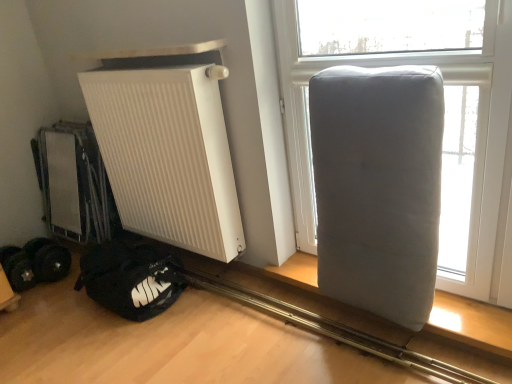
The width and height of the screenshot is (512, 384). What do you see at coordinates (130, 279) in the screenshot? I see `black fabric sleeping bag at lower left` at bounding box center [130, 279].

What do you see at coordinates (168, 155) in the screenshot?
I see `white matte radiator at left` at bounding box center [168, 155].

Describe the element at coordinates (35, 263) in the screenshot. Image resolution: width=512 pixels, height=384 pixels. I see `black rubber weights at lower left` at that location.

Locate an element on the screen. This screenshot has height=384, width=512. black fabric sleeping bag at lower left is located at coordinates (130, 279).

Which object is wider, white matte radiator at left or gray fabric cushion at right?

With larger width is white matte radiator at left.

Is white matte radiator at left smaller than gray fabric cushion at right?

No, white matte radiator at left is not smaller than gray fabric cushion at right.

Is white matte radiator at left positioned before gray fabric cushion at right?

No, the depth of white matte radiator at left is greater than that of gray fabric cushion at right.

Is white matte radiator at left positioned with its back to gray fabric cushion at right?

No, gray fabric cushion at right is not at the back of white matte radiator at left.

Is gray fabric mattress at right turned away from black rubber weights at lower left?

No.

Is the depth of gray fabric mattress at right less than that of black rubber weights at lower left?

Yes, gray fabric mattress at right is closer to the camera.

Is gray fabric mattress at right next to black rubber weights at lower left and touching it?

No.

Considering the sizes of objects gray fabric mattress at right and black rubber weights at lower left in the image provided, who is shorter, gray fabric mattress at right or black rubber weights at lower left?

With less height is black rubber weights at lower left.

From the image's perspective, does gray fabric mattress at right appear higher than gray fabric cushion at right?

No, from the image's perspective, gray fabric mattress at right is not on top of gray fabric cushion at right.

Is gray fabric cushion at right at the back of gray fabric mattress at right?

Yes, gray fabric mattress at right is facing away from gray fabric cushion at right.

Does gray fabric mattress at right have a larger size compared to gray fabric cushion at right?

Correct, gray fabric mattress at right is larger in size than gray fabric cushion at right.

Consider the image. Is gray fabric mattress at right situated inside gray fabric cushion at right or outside?

The correct answer is: outside.

Measure the distance from white matte radiator at left to black rubber weights at lower left.

white matte radiator at left and black rubber weights at lower left are 31.73 inches apart from each other.

From a real-world perspective, who is located lower, white matte radiator at left or black rubber weights at lower left?

black rubber weights at lower left, from a real-world perspective.

Considering the relative sizes of white matte radiator at left and black rubber weights at lower left in the image provided, is white matte radiator at left shorter than black rubber weights at lower left?

In fact, white matte radiator at left may be taller than black rubber weights at lower left.

Is white matte radiator at left wider or thinner than black rubber weights at lower left?

In the image, white matte radiator at left appears to be more narrow than black rubber weights at lower left.

From the image's perspective, is black fabric sleeping bag at lower left located above or below gray fabric mattress at right?

From the image's perspective, black fabric sleeping bag at lower left appears below gray fabric mattress at right.

Is black fabric sleeping bag at lower left turned away from gray fabric mattress at right?

black fabric sleeping bag at lower left does not have its back to gray fabric mattress at right.

In terms of width, does black fabric sleeping bag at lower left look wider or thinner when compared to gray fabric mattress at right?

Clearly, black fabric sleeping bag at lower left has more width compared to gray fabric mattress at right.

At what (x,y) coordinates should I click in order to perform the action: click on sleeping bag behind the gray fabric mattress at right. Please return your answer as a coordinate pair (x, y). The height and width of the screenshot is (384, 512). Looking at the image, I should click on (130, 279).

Considering the sizes of objects black fabric sleeping bag at lower left and gray fabric cushion at right in the image provided, who is smaller, black fabric sleeping bag at lower left or gray fabric cushion at right?

black fabric sleeping bag at lower left is smaller.

Which is more to the left, black fabric sleeping bag at lower left or gray fabric cushion at right?

black fabric sleeping bag at lower left is more to the left.

Does black fabric sleeping bag at lower left have a greater width compared to gray fabric cushion at right?

Yes.

Is point (134, 263) closer to camera compared to point (504, 291)?

No, it is behind (504, 291).

Does black rubber weights at lower left have a lesser height compared to gray fabric cushion at right?

Yes.

Would you say black rubber weights at lower left is inside or outside gray fabric cushion at right?

black rubber weights at lower left exists outside the volume of gray fabric cushion at right.

Who is more distant, black rubber weights at lower left or gray fabric cushion at right?

black rubber weights at lower left is behind.

Is point (14, 274) positioned in front of point (305, 171)?

No, (14, 274) is further to viewer.

Identify the location of window in front of the white matte radiator at left. The width and height of the screenshot is (512, 384). (472, 137).

At what (x,y) coordinates should I click in order to perform the action: click on furniture above the black rubber weights at lower left (from a real-world perspective). Please return your answer as a coordinate pair (x, y). The height and width of the screenshot is (384, 512). Looking at the image, I should click on (378, 186).

Estimate the real-world distances between objects in this image. Which object is further from gray fabric cushion at right, gray fabric mattress at right or black fabric sleeping bag at lower left?

The object further to gray fabric cushion at right is black fabric sleeping bag at lower left.

Looking at the image, which one is located further to white matte radiator at left, gray fabric cushion at right or black rubber weights at lower left?

black rubber weights at lower left is further to white matte radiator at left.

Estimate the real-world distances between objects in this image. Which object is closer to white matte radiator at left, gray fabric cushion at right or black fabric sleeping bag at lower left?

The object closer to white matte radiator at left is black fabric sleeping bag at lower left.

Considering their positions, is white matte radiator at left positioned further to gray fabric mattress at right than black rubber weights at lower left?

black rubber weights at lower left.

Based on their spatial positions, is gray fabric cushion at right or white matte radiator at left further from black fabric sleeping bag at lower left?

gray fabric cushion at right lies further to black fabric sleeping bag at lower left than the other object.

Looking at this image, considering their positions, is black rubber weights at lower left positioned closer to gray fabric cushion at right than gray fabric mattress at right?

gray fabric mattress at right.

Considering their positions, is gray fabric cushion at right positioned further to gray fabric mattress at right than white matte radiator at left?

The object further to gray fabric mattress at right is white matte radiator at left.

Considering their positions, is white matte radiator at left positioned closer to gray fabric mattress at right than black fabric sleeping bag at lower left?

Based on the image, white matte radiator at left appears to be nearer to gray fabric mattress at right.

Where is `radiator between black fabric sleeping bag at lower left and gray fabric mattress at right in the horizontal direction`? radiator between black fabric sleeping bag at lower left and gray fabric mattress at right in the horizontal direction is located at coordinates (168, 155).

Image resolution: width=512 pixels, height=384 pixels. Find the location of `furniture between black rubber weights at lower left and gray fabric cushion at right from left to right`. furniture between black rubber weights at lower left and gray fabric cushion at right from left to right is located at coordinates (378, 186).

At what (x,y) coordinates should I click in order to perform the action: click on sleeping bag between black rubber weights at lower left and gray fabric mattress at right from left to right. Please return your answer as a coordinate pair (x, y). Image resolution: width=512 pixels, height=384 pixels. Looking at the image, I should click on (130, 279).

Where is `radiator between black rubber weights at lower left and gray fabric mattress at right in the horizontal direction`? The height and width of the screenshot is (384, 512). radiator between black rubber weights at lower left and gray fabric mattress at right in the horizontal direction is located at coordinates (168, 155).